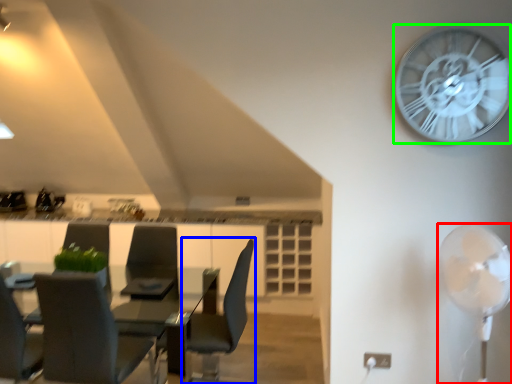
Question: Which object is positioned farthest from mechanical fan (highlighted by a red box)? Select from chair (highlighted by a blue box) and wall clock (highlighted by a green box).

Choices:
 (A) chair
 (B) wall clock

Answer: (A)